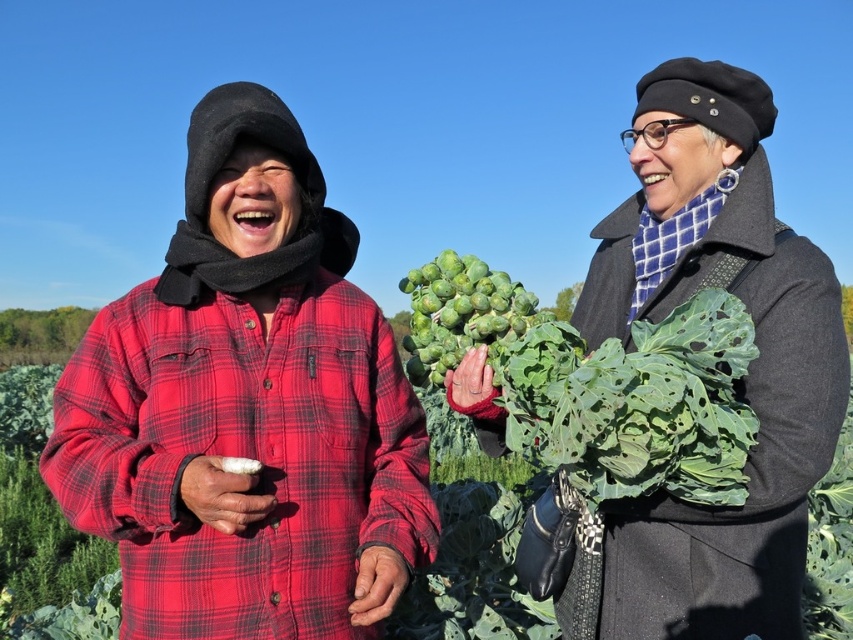
Can you confirm if red plaid shirt at center is wider than white fluffy food at center?

Indeed, red plaid shirt at center has a greater width compared to white fluffy food at center.

Which is in front, point (103, 467) or point (256, 465)?

Point (256, 465) is more forward.

At what (x,y) coordinates should I click in order to perform the action: click on red plaid shirt at center. Please return your answer as a coordinate pair (x, y). The width and height of the screenshot is (853, 640). Looking at the image, I should click on (247, 408).

Is green leafy vegetable at center wider than white fluffy food at center?

Correct, the width of green leafy vegetable at center exceeds that of white fluffy food at center.

Between green leafy vegetable at center and white fluffy food at center, which one appears on the right side from the viewer's perspective?

Positioned to the right is green leafy vegetable at center.

Is point (502, 400) farther from camera compared to point (236, 465)?

That is True.

Find the location of a particular element. The width and height of the screenshot is (853, 640). green leafy vegetable at center is located at coordinates (635, 403).

Can you confirm if green leafy vegetable at center is positioned to the left of green matte brussels sprouts at center?

In fact, green leafy vegetable at center is to the right of green matte brussels sprouts at center.

Does green leafy vegetable at center lie behind green matte brussels sprouts at center?

No, it is not.

Find the location of a particular element. green leafy vegetable at center is located at coordinates (635, 403).